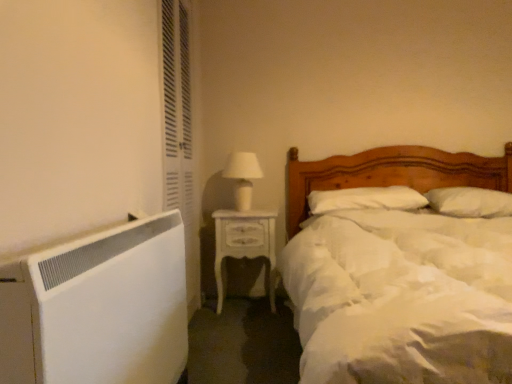
Question: Is white soft pillow at center, marked as the second pillow in a right-to-left arrangement, oriented towards white matte wood bed at center?

Choices:
 (A) yes
 (B) no

Answer: (A)

Question: From a real-world perspective, is white soft pillow at center, marked as the second pillow in a right-to-left arrangement, positioned over white matte wood bed at center based on gravity?

Choices:
 (A) no
 (B) yes

Answer: (B)

Question: From the image's perspective, is white soft pillow at center, marked as the second pillow in a right-to-left arrangement, located beneath white matte wood bed at center?

Choices:
 (A) no
 (B) yes

Answer: (A)

Question: Can you confirm if white soft pillow at center, which is the 1th pillow in left-to-right order, is bigger than white matte wood bed at center?

Choices:
 (A) yes
 (B) no

Answer: (B)

Question: Can you confirm if white soft pillow at center, marked as the second pillow in a right-to-left arrangement, is thinner than white matte wood bed at center?

Choices:
 (A) no
 (B) yes

Answer: (B)

Question: Can you confirm if white soft pillow at center, which is the 1th pillow in left-to-right order, is bigger than white glossy nightstand at center?

Choices:
 (A) yes
 (B) no

Answer: (B)

Question: Is the surface of white soft pillow at center, which is the 1th pillow in left-to-right order, in direct contact with white glossy nightstand at center?

Choices:
 (A) no
 (B) yes

Answer: (A)

Question: Considering the relative sizes of white soft pillow at center, which is the 1th pillow in left-to-right order, and white glossy nightstand at center in the image provided, is white soft pillow at center, which is the 1th pillow in left-to-right order, smaller than white glossy nightstand at center?

Choices:
 (A) yes
 (B) no

Answer: (A)

Question: From the image's perspective, is white soft pillow at center, marked as the second pillow in a right-to-left arrangement, located beneath white glossy nightstand at center?

Choices:
 (A) no
 (B) yes

Answer: (A)

Question: Is white soft pillow at center, marked as the second pillow in a right-to-left arrangement, taller than white glossy nightstand at center?

Choices:
 (A) yes
 (B) no

Answer: (B)

Question: From a real-world perspective, is white soft pillow at center, marked as the second pillow in a right-to-left arrangement, physically below white glossy nightstand at center?

Choices:
 (A) no
 (B) yes

Answer: (A)

Question: Is white soft pillow at upper right, the 2th pillow in the left-to-right sequence, at the right side of white textured screen door at left?

Choices:
 (A) yes
 (B) no

Answer: (A)